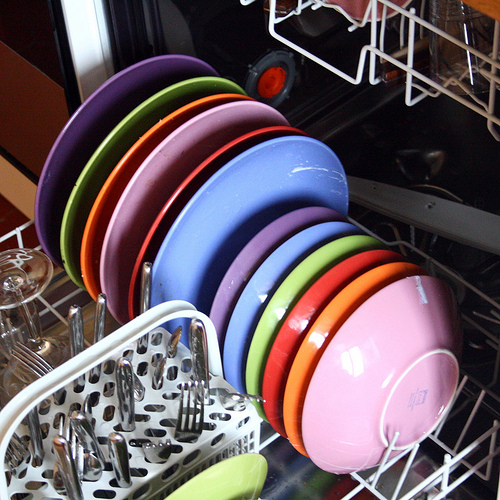
Identify the location of bowl. The height and width of the screenshot is (500, 500). (260, 243), (280, 265), (305, 269), (319, 283), (339, 303), (372, 332).